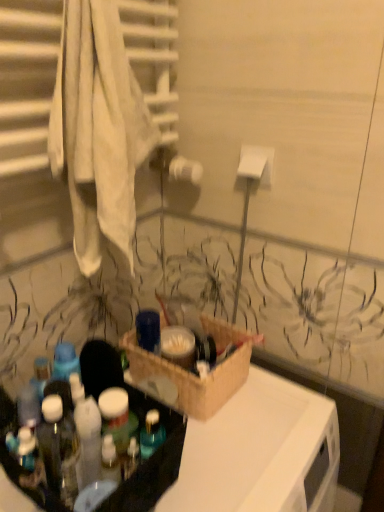
Identify the location of free spot in front of woven basket at center. Image resolution: width=384 pixels, height=512 pixels. (237, 455).